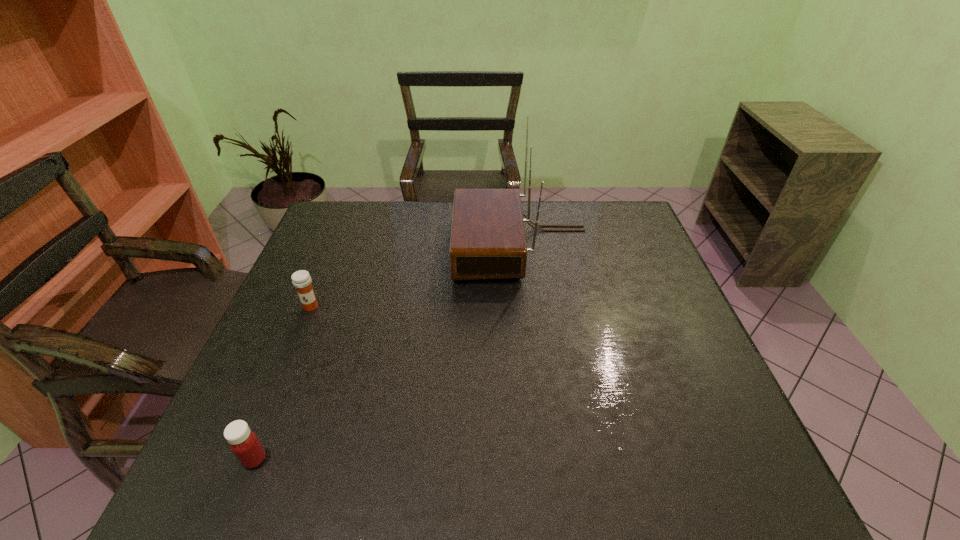
Identify the location of vacant space that satisfies the following two spatial constraints: 1. on the label side of the nearest object; 2. on the left side of the second farthest object. The height and width of the screenshot is (540, 960). (249, 459).

Locate an element on the screen. free space that satisfies the following two spatial constraints: 1. on the label side of the nearest object; 2. on the left side of the second nearest object is located at coordinates tap(249, 459).

Where is `free space that satisfies the following two spatial constraints: 1. on the label side of the second nearest object; 2. on the left side of the nearer medicine`? free space that satisfies the following two spatial constraints: 1. on the label side of the second nearest object; 2. on the left side of the nearer medicine is located at coordinates (249, 459).

The image size is (960, 540). I want to click on vacant area in the image that satisfies the following two spatial constraints: 1. on the front panel of the rightmost object; 2. on the label side of the second nearest object, so click(x=529, y=307).

Find the location of a particular element. The width and height of the screenshot is (960, 540). vacant space that satisfies the following two spatial constraints: 1. on the label side of the farther medicine; 2. on the right side of the nearer medicine is located at coordinates (249, 459).

The height and width of the screenshot is (540, 960). I want to click on free space that satisfies the following two spatial constraints: 1. on the label side of the farther medicine; 2. on the right side of the nearer medicine, so click(249, 459).

In order to click on blank space that satisfies the following two spatial constraints: 1. on the front panel of the rightmost object; 2. on the label side of the farther medicine in this screenshot , I will do `click(529, 307)`.

Where is `vacant space that satisfies the following two spatial constraints: 1. on the front panel of the tallest object; 2. on the label side of the farther medicine`? vacant space that satisfies the following two spatial constraints: 1. on the front panel of the tallest object; 2. on the label side of the farther medicine is located at coordinates (529, 307).

I want to click on free location that satisfies the following two spatial constraints: 1. on the front panel of the tallest object; 2. on the label side of the second farthest object, so (529, 307).

Locate an element on the screen. free space in the image that satisfies the following two spatial constraints: 1. on the front panel of the farthest object; 2. on the label side of the second farthest object is located at coordinates (529, 307).